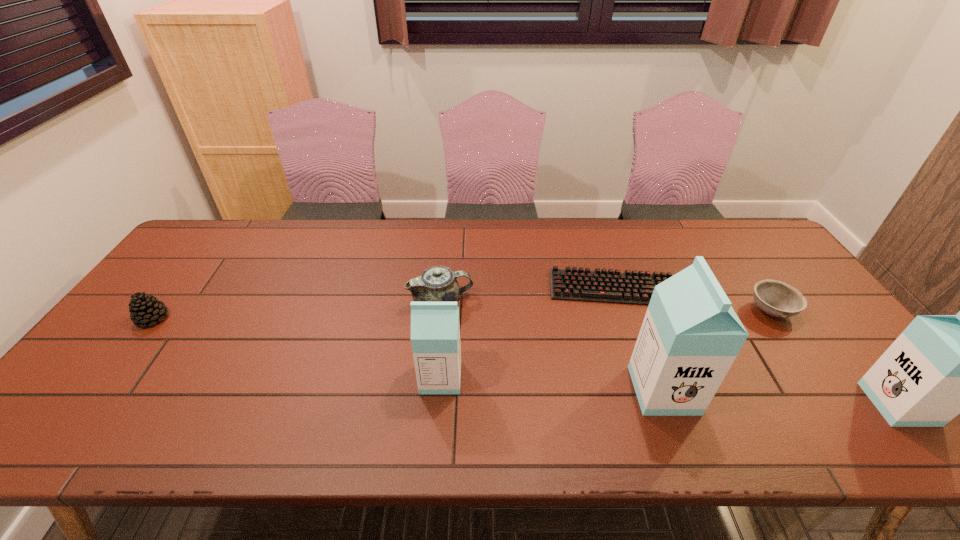
The image size is (960, 540). Identify the location of the fifth shortest object. coord(435,329).

Where is `the shortest milk carton`? This screenshot has width=960, height=540. the shortest milk carton is located at coordinates (435, 329).

Identify the location of the second milk carton from left to right. The height and width of the screenshot is (540, 960). (690, 336).

The image size is (960, 540). I want to click on the rightmost object, so click(940, 366).

Image resolution: width=960 pixels, height=540 pixels. I want to click on the sixth shortest object, so click(940, 366).

The image size is (960, 540). What are the coordinates of `the fifth tallest object` in the screenshot? It's located at (144, 309).

Identify the location of the leftmost object. (144, 309).

The width and height of the screenshot is (960, 540). I want to click on the sixth object from left to right, so click(x=775, y=298).

In order to click on the second shortest object in this screenshot , I will do (x=775, y=298).

Where is `the fourth shortest object`? The image size is (960, 540). the fourth shortest object is located at coordinates (438, 283).